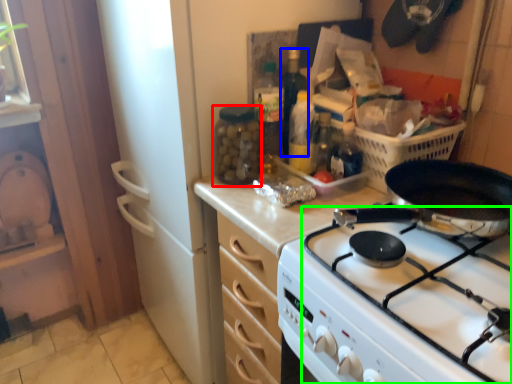
Question: Which object is the closest to the bottle (highlighted by a red box)? Choose among these: bottle (highlighted by a blue box) or gas stove (highlighted by a green box).

Choices:
 (A) bottle
 (B) gas stove

Answer: (A)